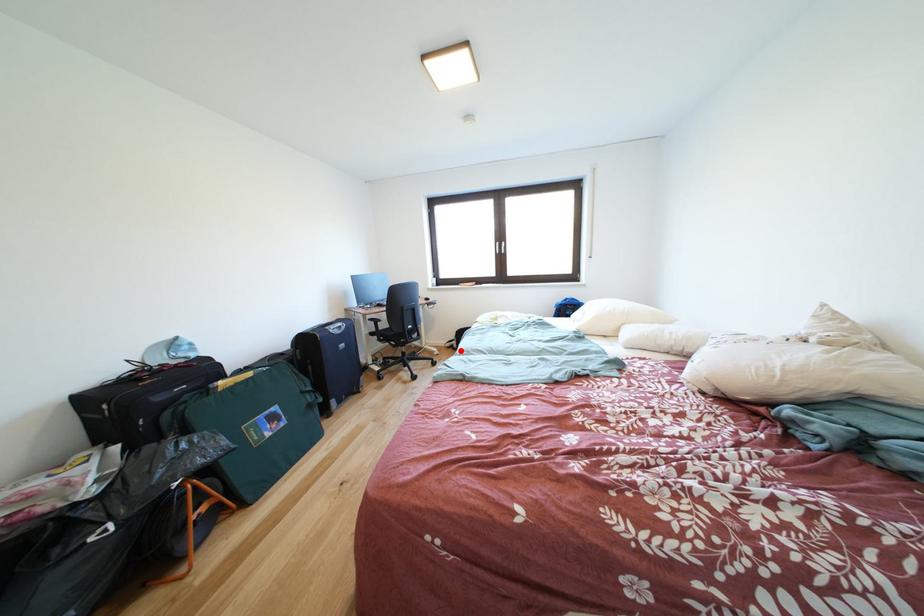
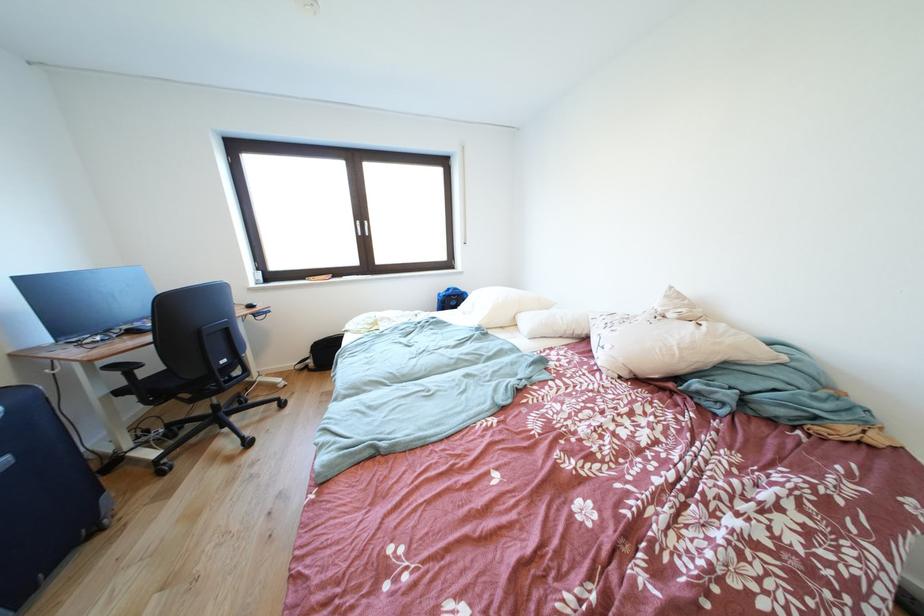
Locate, in the second image, the point that corresponds to the highlighted location in the first image.

(315, 371)